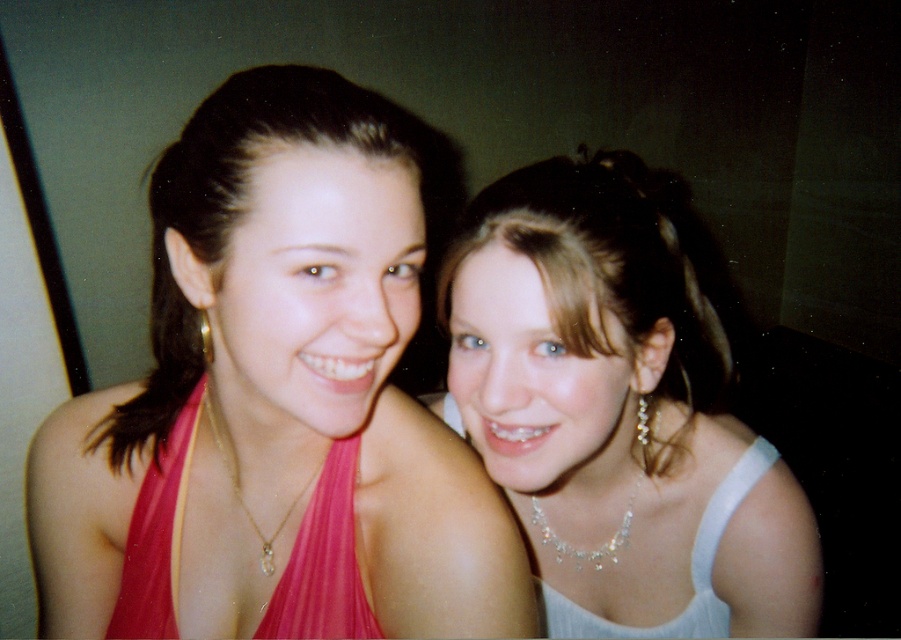
In the scene shown: Who is positioned more to the right, pink satin dress at center or white satin dress at right?

Positioned to the right is white satin dress at right.

Is pink satin dress at center bigger than white satin dress at right?

No.

Does point (347, 452) come farther from viewer compared to point (712, 616)?

No.

Where is `pink satin dress at center`? pink satin dress at center is located at coordinates (323, 563).

Is point (197, 364) in front of point (137, 513)?

No, it is not.

Is pink satin halter top at left wider than pink satin dress at center?

Yes, pink satin halter top at left is wider than pink satin dress at center.

Find the location of a particular element. pink satin halter top at left is located at coordinates (275, 404).

What are the coordinates of `pink satin halter top at left` in the screenshot? It's located at (275, 404).

Which is below, pearl necklace at upper right or white satin dress at right?

white satin dress at right is below.

Does pearl necklace at upper right have a lesser width compared to white satin dress at right?

Incorrect, pearl necklace at upper right's width is not less than white satin dress at right's.

Is point (617, 184) behind point (711, 524)?

No.

Where is `pearl necklace at upper right`? This screenshot has width=901, height=640. pearl necklace at upper right is located at coordinates (619, 408).